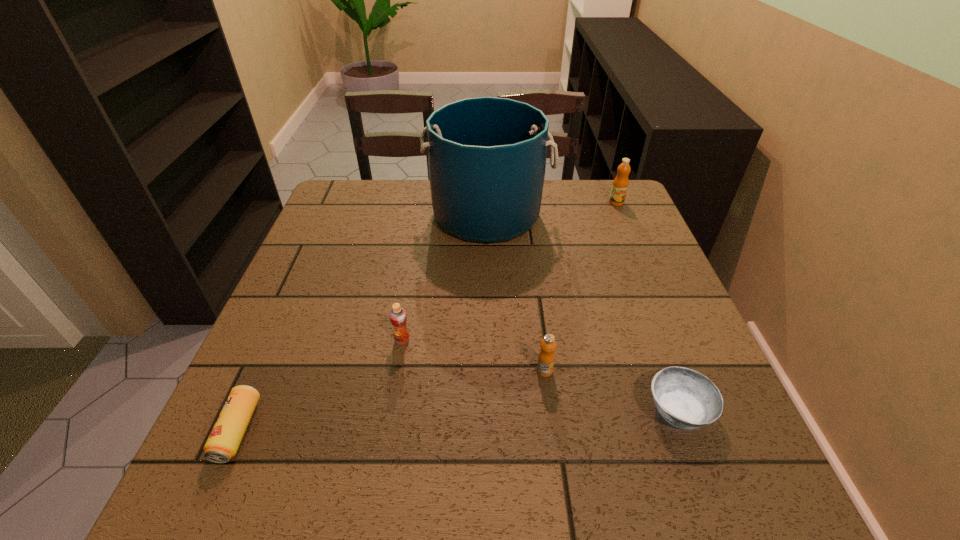
Where is `free space located on the front label of the tallest orange juice`? The width and height of the screenshot is (960, 540). free space located on the front label of the tallest orange juice is located at coordinates (640, 259).

Locate an element on the screen. The height and width of the screenshot is (540, 960). vacant region located 0.130m on the right of the third farthest object is located at coordinates (472, 340).

Locate an element on the screen. vacant space located 0.120m on the front label of the third nearest object is located at coordinates (553, 436).

Find the location of `vacant space located on the left of the ashtray`. vacant space located on the left of the ashtray is located at coordinates (567, 410).

Where is `vacant space located on the right of the leftmost object`? The image size is (960, 540). vacant space located on the right of the leftmost object is located at coordinates (470, 430).

The height and width of the screenshot is (540, 960). In order to click on bucket that is at the far edge in this screenshot , I will do click(486, 155).

Where is `orange juice located at the far edge`? The height and width of the screenshot is (540, 960). orange juice located at the far edge is located at coordinates (620, 184).

Locate an element on the screen. object that is at the near edge is located at coordinates (222, 444).

Locate an element on the screen. This screenshot has width=960, height=540. object located in the left edge section of the desktop is located at coordinates (222, 444).

Locate an element on the screen. Image resolution: width=960 pixels, height=540 pixels. orange juice that is at the right edge is located at coordinates (620, 184).